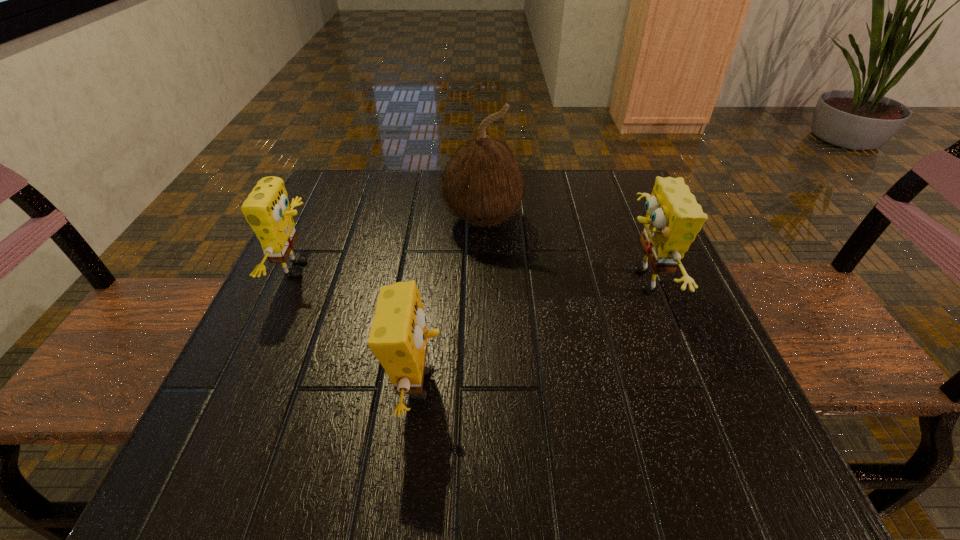
Identify the location of the tallest object. The width and height of the screenshot is (960, 540). tap(483, 184).

The width and height of the screenshot is (960, 540). What are the coordinates of `the rightmost object` in the screenshot? It's located at (673, 219).

This screenshot has width=960, height=540. In order to click on the leftmost object in this screenshot , I will do `click(266, 209)`.

Where is `the second sponge from left to right`? The image size is (960, 540). the second sponge from left to right is located at coordinates click(398, 337).

You are a GUI agent. You are given a task and a screenshot of the screen. Output one action in this format:
    pyautogui.click(x=<x>, y=<y>)
    Task: Click on the vacant area situated on the surface of the coconut
    
    Given the screenshot: What is the action you would take?
    pyautogui.click(x=484, y=306)

Where is `free space located 0.190m on the face of the rightmost sponge`? The height and width of the screenshot is (540, 960). free space located 0.190m on the face of the rightmost sponge is located at coordinates (516, 282).

Where is `free point located 0.360m on the face of the rightmost sponge`? This screenshot has width=960, height=540. free point located 0.360m on the face of the rightmost sponge is located at coordinates (424, 282).

Image resolution: width=960 pixels, height=540 pixels. What are the coordinates of `free spot located on the face of the rightmost sponge` in the screenshot? It's located at (463, 282).

Where is `vacant space located 0.110m on the face of the leftmost object`? The image size is (960, 540). vacant space located 0.110m on the face of the leftmost object is located at coordinates (373, 269).

This screenshot has width=960, height=540. What are the coordinates of `vacant space located 0.180m on the face of the second sponge from right to left` in the screenshot? It's located at coord(565,384).